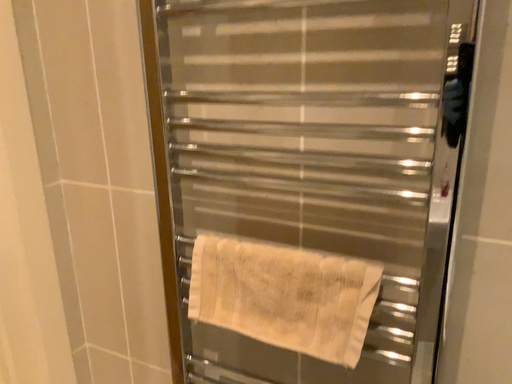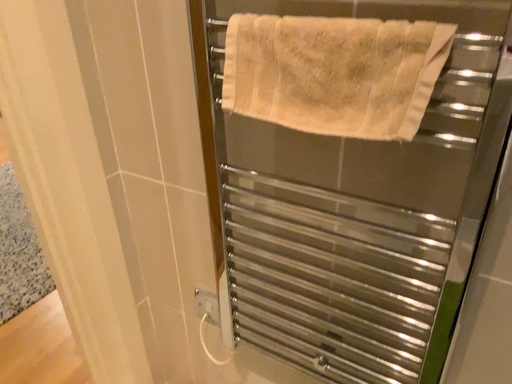
Question: How did the camera likely rotate when shooting the video?

Choices:
 (A) rotated upward
 (B) rotated downward

Answer: (B)